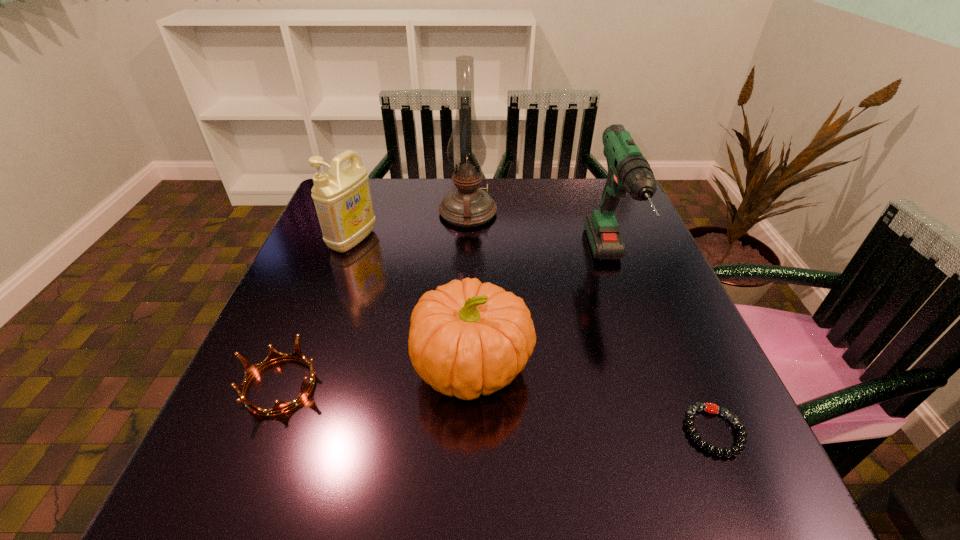
I want to click on oil lamp, so click(x=467, y=206).

Where is `drill`? This screenshot has width=960, height=540. drill is located at coordinates (628, 170).

This screenshot has width=960, height=540. I want to click on detergent, so click(342, 198).

Where is `the fourth tallest object`? The width and height of the screenshot is (960, 540). the fourth tallest object is located at coordinates (466, 338).

The height and width of the screenshot is (540, 960). What are the coordinates of `crown` in the screenshot? It's located at (251, 370).

Find the location of a particular element. The width and height of the screenshot is (960, 540). the shortest object is located at coordinates (711, 408).

Where is `vacant space located 0.110m on the left of the tallest object`? The width and height of the screenshot is (960, 540). vacant space located 0.110m on the left of the tallest object is located at coordinates (398, 212).

Identify the location of free space located 0.140m on the handle side of the fifth shortest object. This screenshot has height=540, width=960. (648, 376).

You are a GUI agent. You are given a task and a screenshot of the screen. Output one action in this format:
    pyautogui.click(x=<x>, y=<y>)
    Task: Click on the vacant area situated 0.310m on the right of the detergent
    
    Given the screenshot: What is the action you would take?
    pyautogui.click(x=499, y=240)

Locate an element on the screen. The width and height of the screenshot is (960, 540). vacant position located on the surface of the pumpkin is located at coordinates (576, 366).